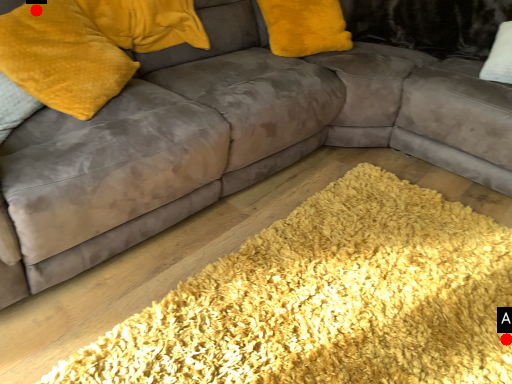
Question: Two points are circled on the image, labeled by A and B beside each circle. Which point is closer to the camera taking this photo?

Choices:
 (A) A is closer
 (B) B is closer

Answer: (A)